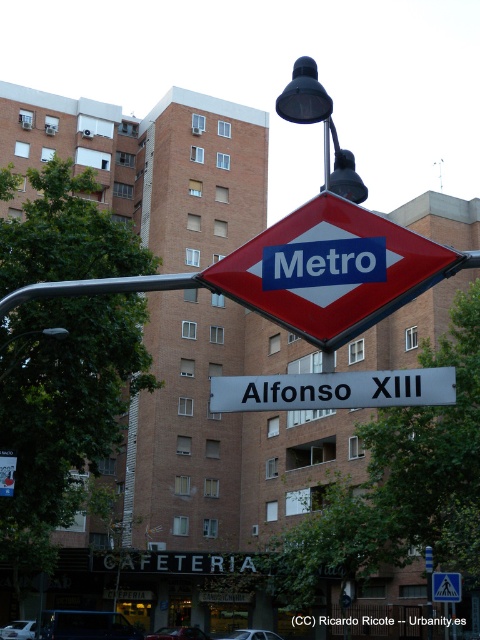
Question: Which object appears farthest from the camera in this image?

Choices:
 (A) metallic pole at lower left
 (B) white metallic signboard at center
 (C) yellow reflective triangle at upper center
 (D) red diamond sign at center

Answer: (C)

Question: Based on their relative distances, which object is nearer to the metallic pole at lower left?

Choices:
 (A) white metallic signboard at center
 (B) yellow reflective triangle at upper center

Answer: (B)

Question: Based on their relative distances, which object is nearer to the yellow reflective triangle at upper center?

Choices:
 (A) white metallic signboard at center
 (B) red diamond sign at center
 (C) metallic pole at lower left

Answer: (C)

Question: From the image, what is the correct spatial relationship of white metallic signboard at center in relation to yellow reflective triangle at upper center?

Choices:
 (A) left
 (B) right

Answer: (A)

Question: Considering the relative positions of red diamond sign at center and metallic pole at lower left in the image provided, where is red diamond sign at center located with respect to metallic pole at lower left?

Choices:
 (A) left
 (B) right

Answer: (B)

Question: Does red diamond sign at center have a smaller size compared to white metallic signboard at center?

Choices:
 (A) yes
 (B) no

Answer: (A)